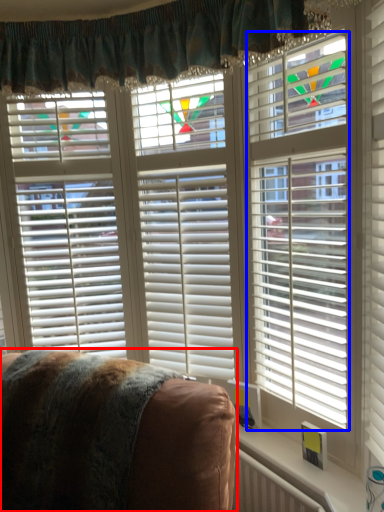
Question: Which point is further to the camera, furniture (highlighted by a red box) or blind (highlighted by a blue box)?

Choices:
 (A) furniture
 (B) blind

Answer: (B)